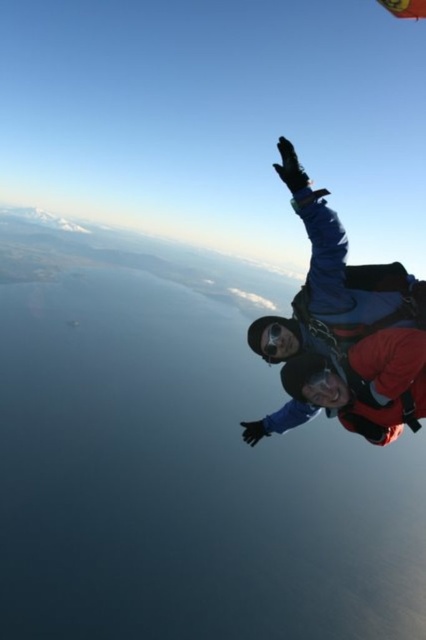
You are a skydiver who wants to know which parachute is wider between the blue fabric parachute at right and the red nylon parachute at upper right. Can you tell me?

The red nylon parachute at upper right is wider than the blue fabric parachute at right.

Consider the image. You are a drone operator trying to capture a photo of the blue fabric parachute at right and the red nylon parachute at upper right from above. The camera has a maximum range of 20 meters. Can you capture both parachutes in one shot?

The blue fabric parachute at right is 25.03 meters away from the red nylon parachute at upper right. Since the distance between them exceeds the camera range of 20 meters, the drone cannot capture both parachutes in one shot.